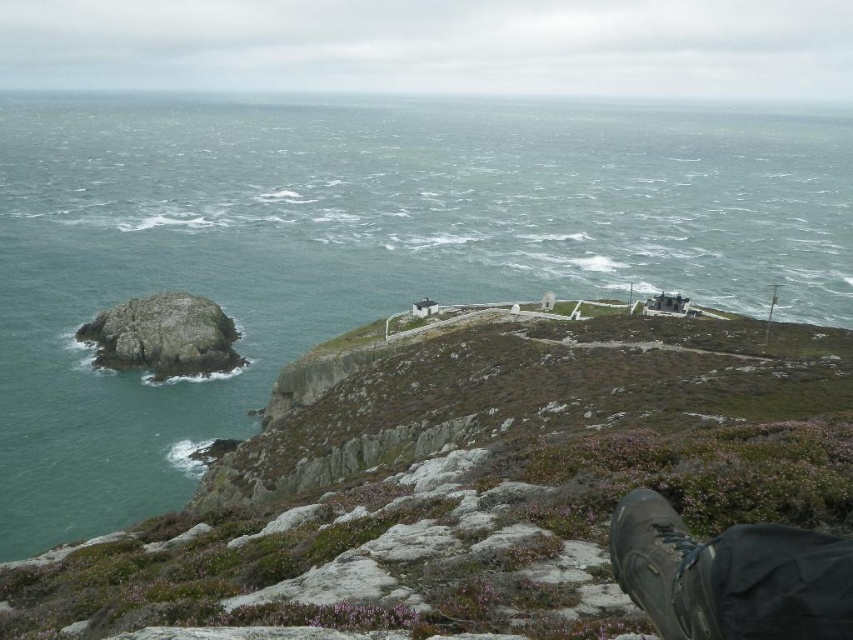
Question: Which point appears closest to the camera in this image?

Choices:
 (A) (656, 568)
 (B) (738, 333)
 (C) (668, 548)
 (D) (502, 125)

Answer: (A)

Question: Is green mossy rock at upper center above black leather boot at lower right?

Choices:
 (A) no
 (B) yes

Answer: (A)

Question: Considering the real-world distances, which object is closest to the brown suede boot at lower right?

Choices:
 (A) greenish-blue water at upper left
 (B) green mossy rock at upper center

Answer: (B)

Question: In this image, where is greenish-blue water at upper left located relative to green mossy rock at upper center?

Choices:
 (A) right
 (B) left

Answer: (B)

Question: Can you confirm if brown suede boot at lower right is smaller than black leather boot at lower right?

Choices:
 (A) no
 (B) yes

Answer: (A)

Question: Estimate the real-world distances between objects in this image. Which object is closer to the greenish-blue water at upper left?

Choices:
 (A) brown suede boot at lower right
 (B) green mossy rock at upper center
 (C) black leather boot at lower right

Answer: (B)